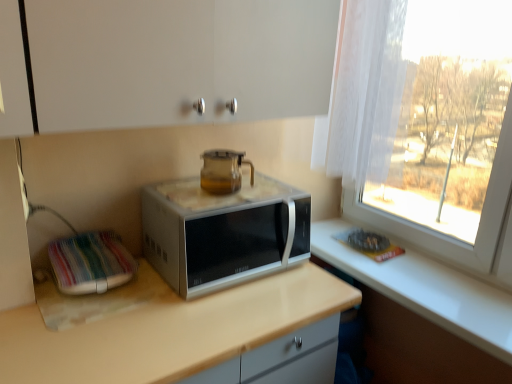
Identify the location of free space above beige laminate countertop at center (from a real-world perspective). The height and width of the screenshot is (384, 512). (167, 311).